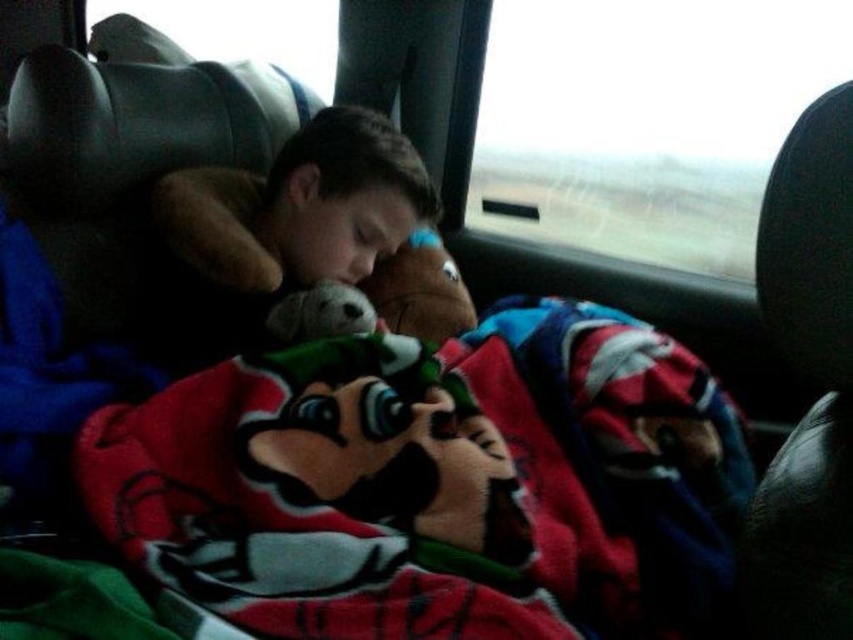
Question: Is red fleece blanket at center positioned in front of soft plush toy at center?

Choices:
 (A) no
 (B) yes

Answer: (B)

Question: Which of the following is the farthest from the observer?

Choices:
 (A) (279, 225)
 (B) (167, 544)

Answer: (A)

Question: Which point appears farthest from the camera in this image?

Choices:
 (A) (556, 348)
 (B) (345, 237)

Answer: (B)

Question: Is red fleece blanket at center to the right of soft plush toy at center from the viewer's perspective?

Choices:
 (A) no
 (B) yes

Answer: (B)

Question: Is the position of red fleece blanket at center more distant than that of soft plush toy at center?

Choices:
 (A) yes
 (B) no

Answer: (B)